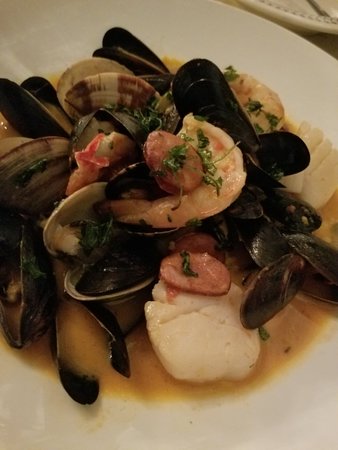
Where is `small silver cup for dipping sauce`? small silver cup for dipping sauce is located at coordinates (128, 313).